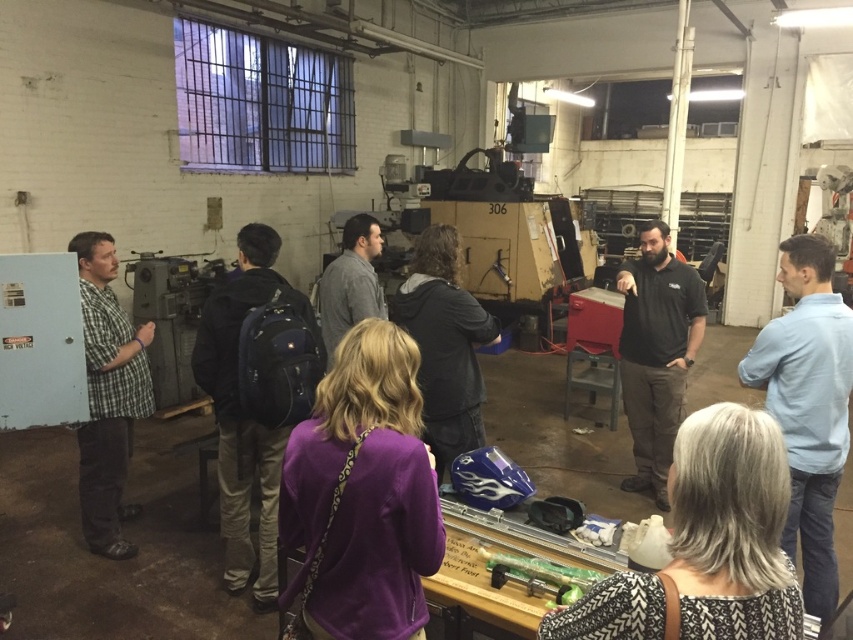
You are a photographer in this workshop setting. You need to capture a photo where both the gray textured sweater at lower right and the black backpack at center are clearly visible. Based on their sizes, which object should you ensure is closer to the camera to avoid being too small in the photo?

The gray textured sweater at lower right is not as tall as the black backpack at center, so to ensure both are clearly visible, the gray textured sweater at lower right should be moved closer to the camera since it is smaller.

You are standing at the point labeled point (x=440, y=259) in the workshop. There is a tool you need at point (x=660, y=308). Can you reach it without moving past the other point?

Yes, since point (x=660, y=308) is behind point (x=440, y=259), you can reach it without moving past the other point.